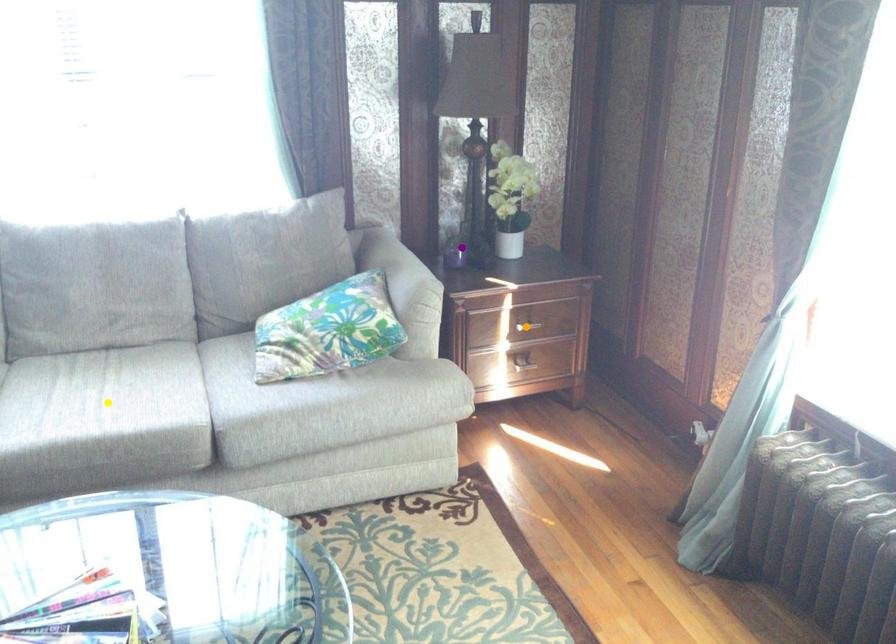
Order these from nearest to farthest:
purple point | orange point | yellow point

purple point < orange point < yellow point